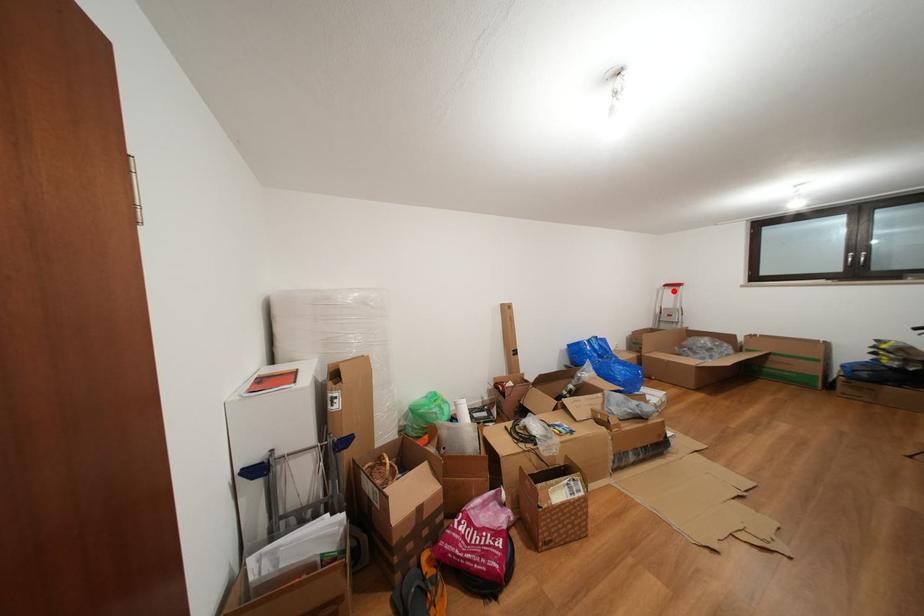
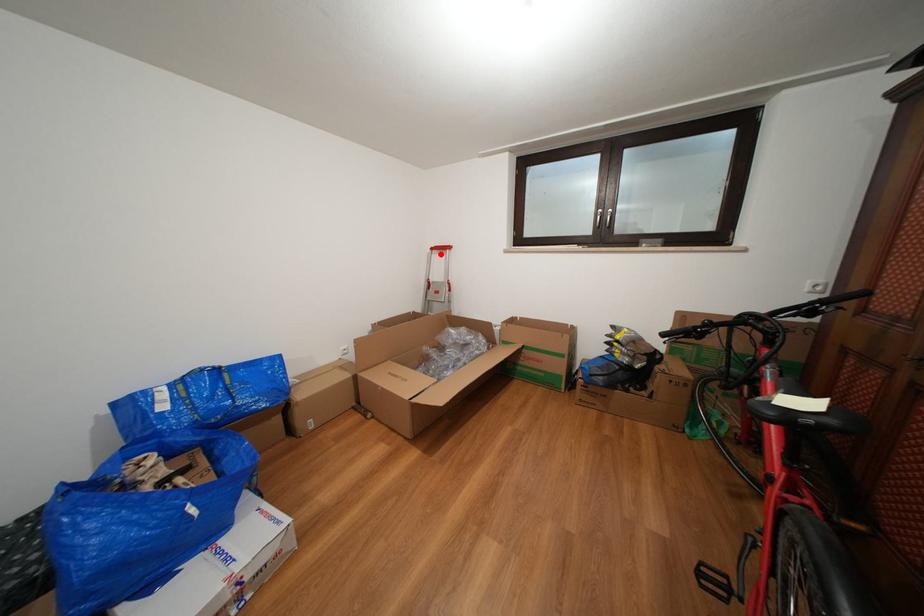
I am providing you with two images of the same scene from different viewpoints. A red point is marked on the first image and another point is marked on the second image. Is the red point in image1 aligned with the point shown in image2?

Yes